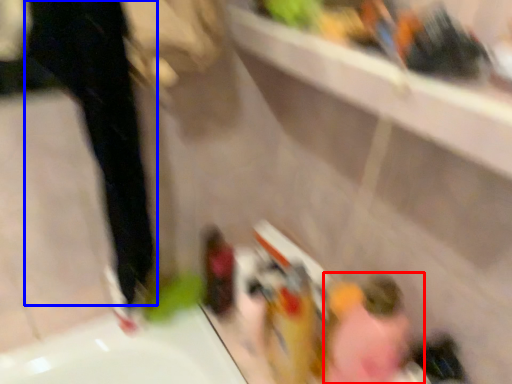
Question: Which point is closer to the camera, woman (highlighted by a red box) or pants (highlighted by a blue box)?

Choices:
 (A) woman
 (B) pants

Answer: (B)